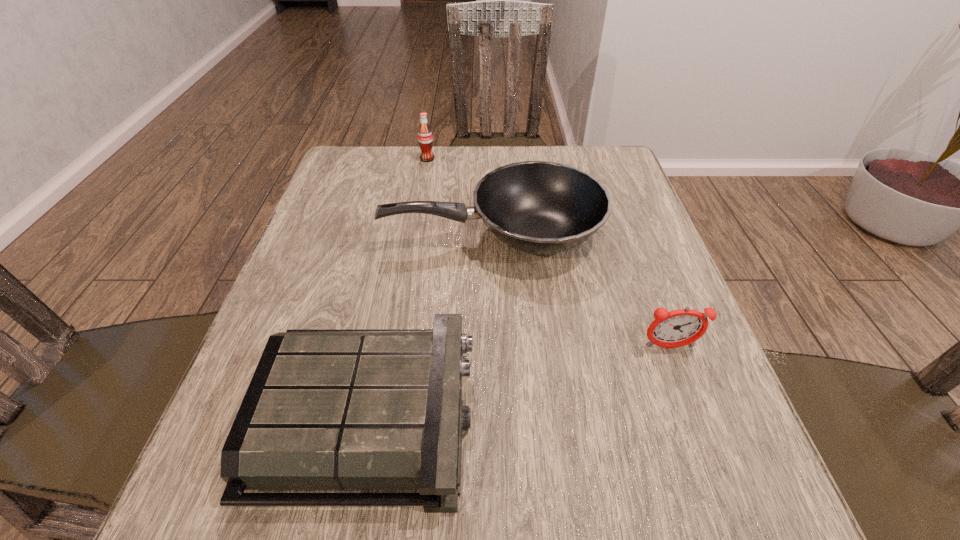
Find the location of `object at the left edge`. object at the left edge is located at coordinates (327, 409).

Image resolution: width=960 pixels, height=540 pixels. I want to click on frying pan present at the right edge, so click(539, 207).

The image size is (960, 540). I want to click on alarm clock that is at the right edge, so click(x=677, y=328).

I want to click on object located at the near left corner, so click(327, 409).

Locate an element on the screen. The height and width of the screenshot is (540, 960). vacant region at the far edge of the desktop is located at coordinates (418, 159).

Image resolution: width=960 pixels, height=540 pixels. In the image, there is a desktop. Identify the location of free region at the near edge. (506, 528).

Locate an element on the screen. vacant region at the left edge of the desktop is located at coordinates (329, 292).

You are a GUI agent. You are given a task and a screenshot of the screen. Output one action in this format:
    pyautogui.click(x=<x>, y=<y>)
    Task: Click on the blank space at the right edge of the desktop
    
    Given the screenshot: What is the action you would take?
    pyautogui.click(x=613, y=219)

Where is `blank area at the far left corner`? The height and width of the screenshot is (540, 960). blank area at the far left corner is located at coordinates (385, 155).

You are a GUI agent. You are given a task and a screenshot of the screen. Output one action in this format:
    pyautogui.click(x=<x>, y=<y>)
    Task: Click on the free spot between the alarm clock and the frying pan
    The image size is (960, 540).
    Given the screenshot: What is the action you would take?
    pyautogui.click(x=581, y=291)